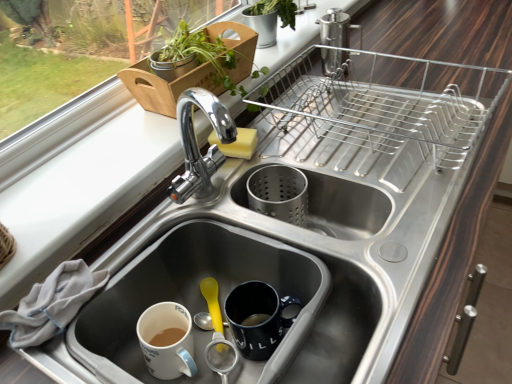
Question: Considering the positions of green leafy plant at upper left, which ranks as the 2th houseplant in back-to-front order, and white matte sink at lower left, marked as the second sink in a right-to-left arrangement, in the image, is green leafy plant at upper left, which ranks as the 2th houseplant in back-to-front order, wider or thinner than white matte sink at lower left, marked as the second sink in a right-to-left arrangement,?

Choices:
 (A) thin
 (B) wide

Answer: (A)

Question: Is green leafy plant at upper left, which ranks as the 2th houseplant in back-to-front order, taller or shorter than white matte sink at lower left, marked as the second sink in a right-to-left arrangement?

Choices:
 (A) tall
 (B) short

Answer: (A)

Question: Based on their relative distances, which object is farther from the white matte sink at lower left, the 1th sink viewed from the left?

Choices:
 (A) green leafy plant at upper left, which ranks as the 2th houseplant in back-to-front order
 (B) white cloth at lower left
 (C) yellow sponge at center
 (D) green matte plant at upper center, the 1th houseplant when ordered from back to front
 (E) stainless steel sink at center, the 1th sink when ordered from right to left

Answer: (D)

Question: Which of these objects is positioned closest to the stainless steel sink at center, the 1th sink when ordered from right to left?

Choices:
 (A) yellow sponge at center
 (B) white cloth at lower left
 (C) green matte plant at upper center, which is the second houseplant in front-to-back order
 (D) green leafy plant at upper left, which ranks as the 2th houseplant in back-to-front order
 (E) white matte sink at lower left, marked as the second sink in a right-to-left arrangement

Answer: (E)